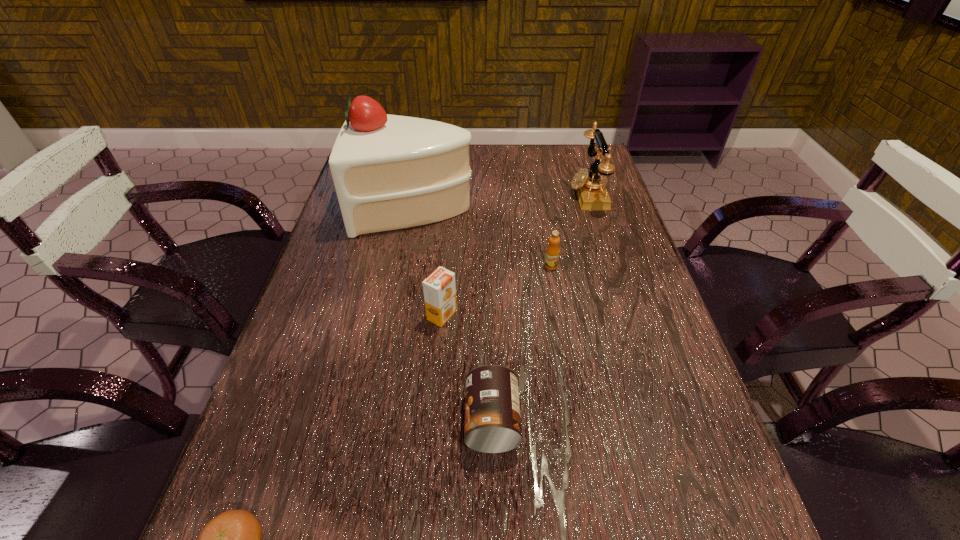
The width and height of the screenshot is (960, 540). I want to click on free space located on the dial of the fifth shortest object, so click(x=508, y=194).

Find the location of a particular element. The image size is (960, 540). vacant space located on the dial of the fifth shortest object is located at coordinates (516, 194).

At what (x,y) coordinates should I click in order to perform the action: click on free space located 0.060m on the dial of the fifth shortest object. Please return your answer as a coordinate pair (x, y). The width and height of the screenshot is (960, 540). Looking at the image, I should click on (549, 194).

You are a GUI agent. You are given a task and a screenshot of the screen. Output one action in this format:
    pyautogui.click(x=<x>, y=<y>)
    Task: Click on the free space located on the right of the third nearest object
    This screenshot has width=960, height=540.
    Given the screenshot: What is the action you would take?
    pyautogui.click(x=582, y=315)

At what (x,y) coordinates should I click in order to perform the action: click on blank area located 0.130m on the front label of the fifth object from left to right. Please return your answer as a coordinate pair (x, y). Image resolution: width=960 pixels, height=540 pixels. Looking at the image, I should click on (559, 311).

This screenshot has height=540, width=960. In order to click on vacant area situated on the front label of the second nearest object in this screenshot , I will do `click(392, 421)`.

The width and height of the screenshot is (960, 540). In order to click on free region located on the front label of the second nearest object in this screenshot , I will do `click(277, 421)`.

Image resolution: width=960 pixels, height=540 pixels. Identify the location of vacant space located on the front label of the second nearest object. [425, 421].

This screenshot has width=960, height=540. Identify the location of cake located at the far edge. (390, 172).

Locate an element on the screen. This screenshot has width=960, height=540. telephone that is at the far edge is located at coordinates (591, 192).